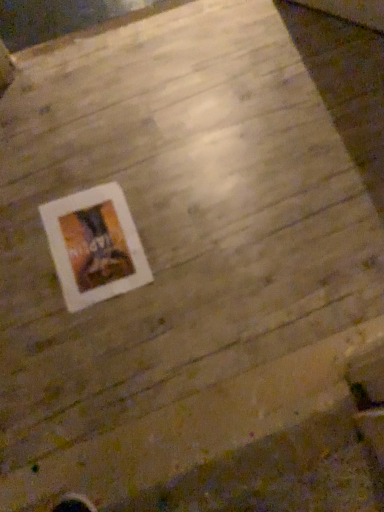
At what (x,y) coordinates should I click in order to perform the action: click on unoccupied space behind white matte picture frame at center. Please return your answer as a coordinate pair (x, y). This screenshot has height=512, width=384. Looking at the image, I should click on (88, 161).